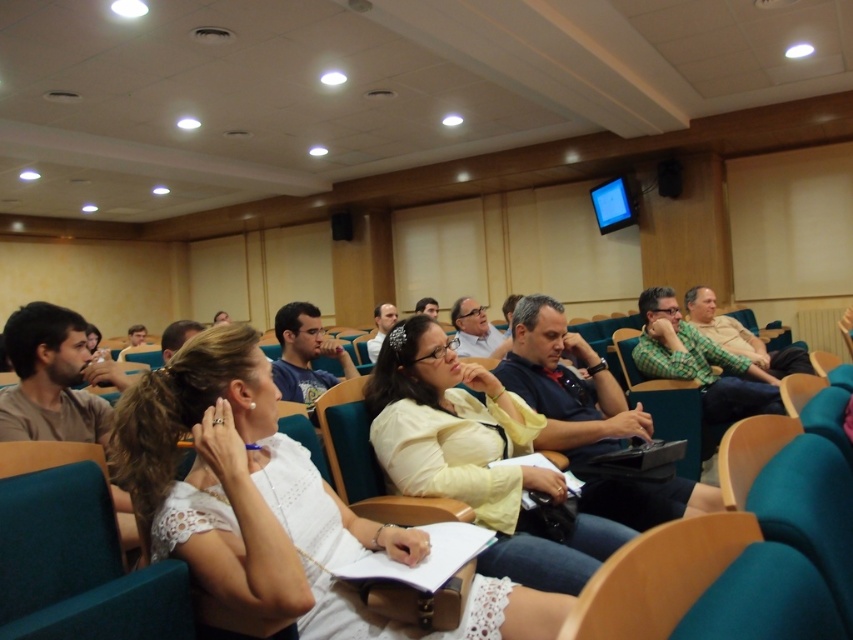
You are standing at the point labeled point (538,332). You want to walk to the front of the room. The front of the room is 8.14 feet away from your current position. How many steps would you need to take if each step is approximately 2.5 feet long?

Since the distance to the front is 8.14 feet and each step is 2.5 feet, you would need approximately 4 steps. 3 steps would cover 7.5 feet, and the fourth step would cover the remaining distance.

You are organizing a photo shoot and need to arrange the matte yellow shirt at center and the green checkered shirt at center based on their sizes. Which shirt should be placed in a position that requires a larger space?

The matte yellow shirt at center is larger in size than the green checkered shirt at center, so it should be placed in the position requiring a larger space.